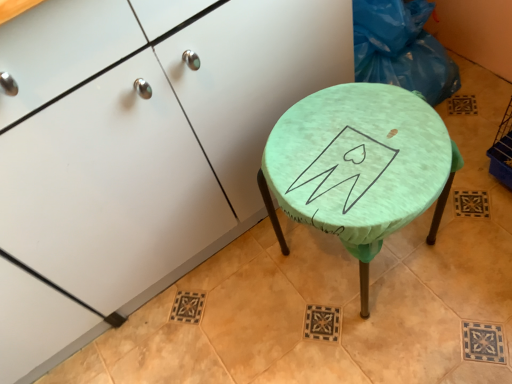
Question: From a real-world perspective, is green fabric-covered stool at center below blue plastic bag at upper right?

Choices:
 (A) yes
 (B) no

Answer: (A)

Question: Is blue plastic bag at upper right at the back of green fabric-covered stool at center?

Choices:
 (A) yes
 (B) no

Answer: (B)

Question: Are green fabric-covered stool at center and blue plastic bag at upper right located far from each other?

Choices:
 (A) no
 (B) yes

Answer: (A)

Question: Considering the relative sizes of green fabric-covered stool at center and blue plastic bag at upper right in the image provided, is green fabric-covered stool at center thinner than blue plastic bag at upper right?

Choices:
 (A) yes
 (B) no

Answer: (B)

Question: From the image's perspective, is green fabric-covered stool at center below blue plastic bag at upper right?

Choices:
 (A) yes
 (B) no

Answer: (A)

Question: From their relative heights in the image, would you say matte white cabinet at center is taller or shorter than green fabric-covered stool at center?

Choices:
 (A) short
 (B) tall

Answer: (B)

Question: From a real-world perspective, relative to green fabric-covered stool at center, is matte white cabinet at center vertically above or below?

Choices:
 (A) below
 (B) above

Answer: (B)

Question: Which is correct: matte white cabinet at center is inside green fabric-covered stool at center, or outside of it?

Choices:
 (A) outside
 (B) inside

Answer: (A)

Question: Considering the positions of point (181, 223) and point (444, 142), is point (181, 223) closer or farther from the camera than point (444, 142)?

Choices:
 (A) closer
 (B) farther

Answer: (B)

Question: From the image's perspective, is blue plastic bag at upper right located above or below green fabric-covered stool at center?

Choices:
 (A) below
 (B) above

Answer: (B)

Question: From a real-world perspective, is blue plastic bag at upper right physically located above or below green fabric-covered stool at center?

Choices:
 (A) below
 (B) above

Answer: (B)

Question: Would you say blue plastic bag at upper right is inside or outside green fabric-covered stool at center?

Choices:
 (A) outside
 (B) inside

Answer: (A)

Question: Looking at their shapes, would you say blue plastic bag at upper right is wider or thinner than green fabric-covered stool at center?

Choices:
 (A) thin
 (B) wide

Answer: (A)

Question: Considering the positions of blue plastic bag at upper right and matte white cabinet at center in the image, is blue plastic bag at upper right wider or thinner than matte white cabinet at center?

Choices:
 (A) wide
 (B) thin

Answer: (B)

Question: From a real-world perspective, relative to matte white cabinet at center, is blue plastic bag at upper right vertically above or below?

Choices:
 (A) below
 (B) above

Answer: (A)